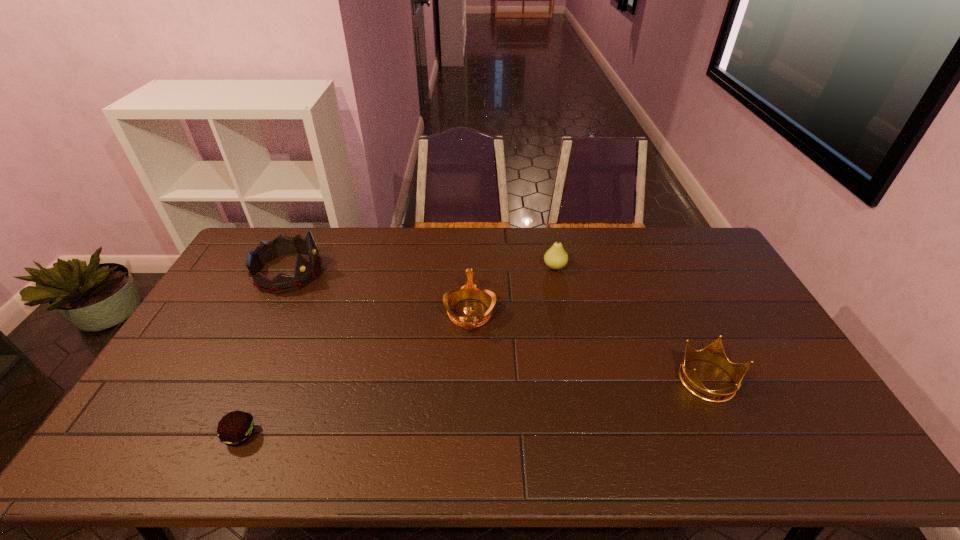
The image size is (960, 540). I want to click on the left tiara, so click(305, 272).

Where is `the tallest object`? The image size is (960, 540). the tallest object is located at coordinates (305, 272).

Where is `the fourth object from left to right`? the fourth object from left to right is located at coordinates (556, 257).

At what (x,y) coordinates should I click in order to perform the action: click on the right tiara. Please return your answer as a coordinate pair (x, y). This screenshot has height=540, width=960. Looking at the image, I should click on coord(469,291).

At what (x,y) coordinates should I click in order to perform the action: click on the third object from right to left. Please return your answer as a coordinate pair (x, y). Looking at the image, I should click on [469, 291].

You are a GUI agent. You are given a task and a screenshot of the screen. Output one action in this format:
    pyautogui.click(x=<x>, y=<y>)
    Task: Click on the crown
    
    Given the screenshot: What is the action you would take?
    (715, 353)

At what (x,y) coordinates should I click in order to perform the action: click on the fourth tallest object. Please return your answer as a coordinate pair (x, y). The width and height of the screenshot is (960, 540). Looking at the image, I should click on (715, 353).

You are a GUI agent. You are given a task and a screenshot of the screen. Output one action in this format:
    pyautogui.click(x=<x>, y=<y>)
    Task: Click on the patty
    This screenshot has height=540, width=960.
    Given the screenshot: What is the action you would take?
    pyautogui.click(x=235, y=428)

The image size is (960, 540). Identify the location of the shortest object. (235, 428).

This screenshot has width=960, height=540. Identify the location of vacant space situated at the front of the taller tiara with jewels. (350, 272).